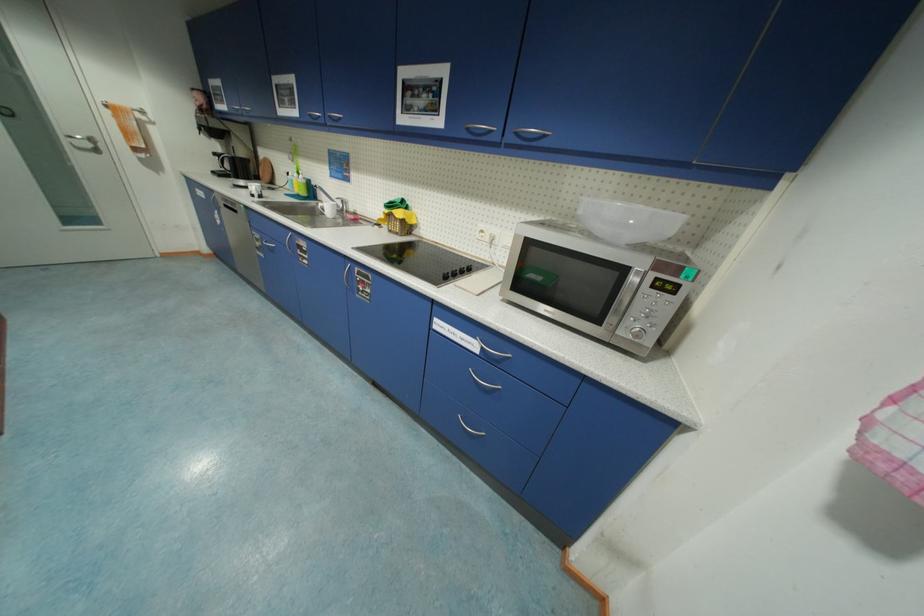
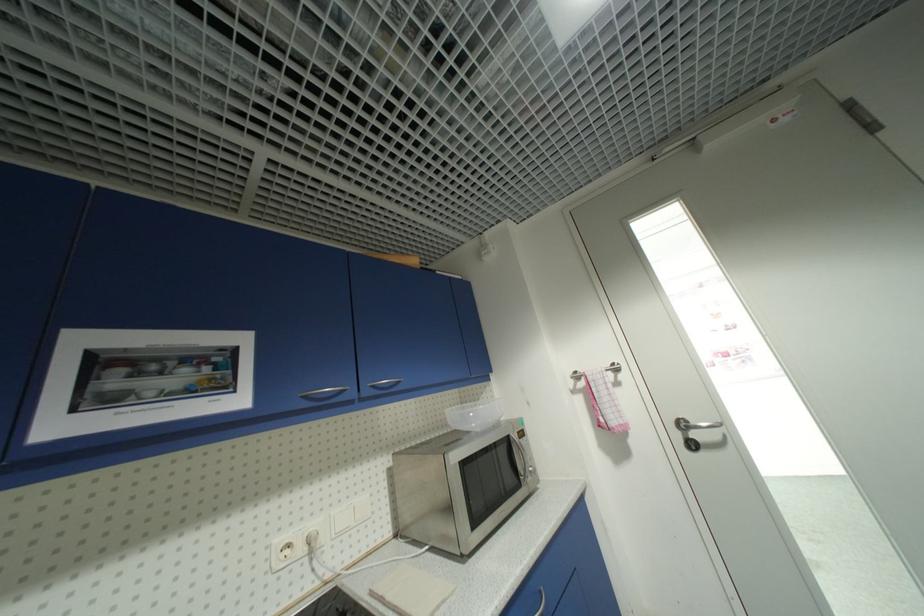
Find the pixel in the second image that matches [488,233] in the first image.

(294, 546)